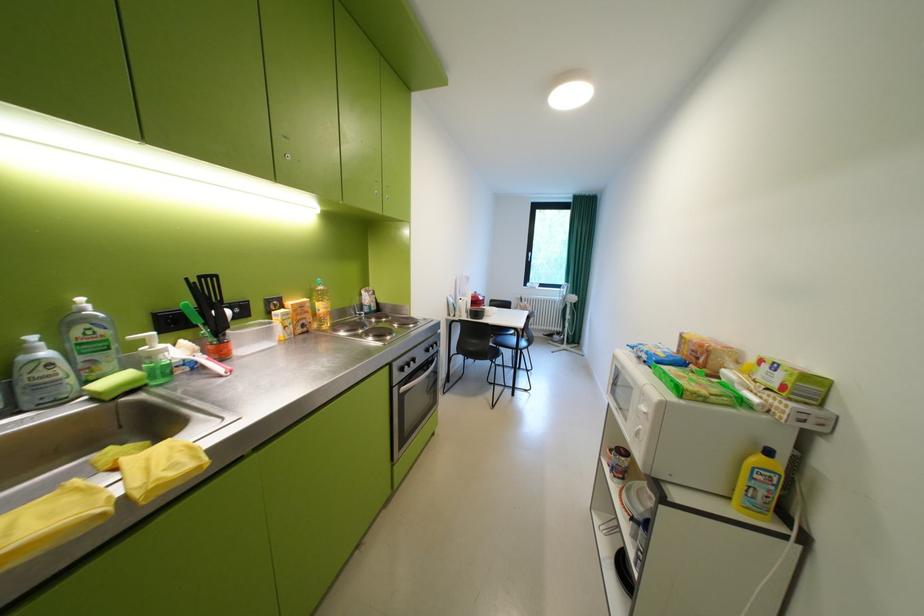
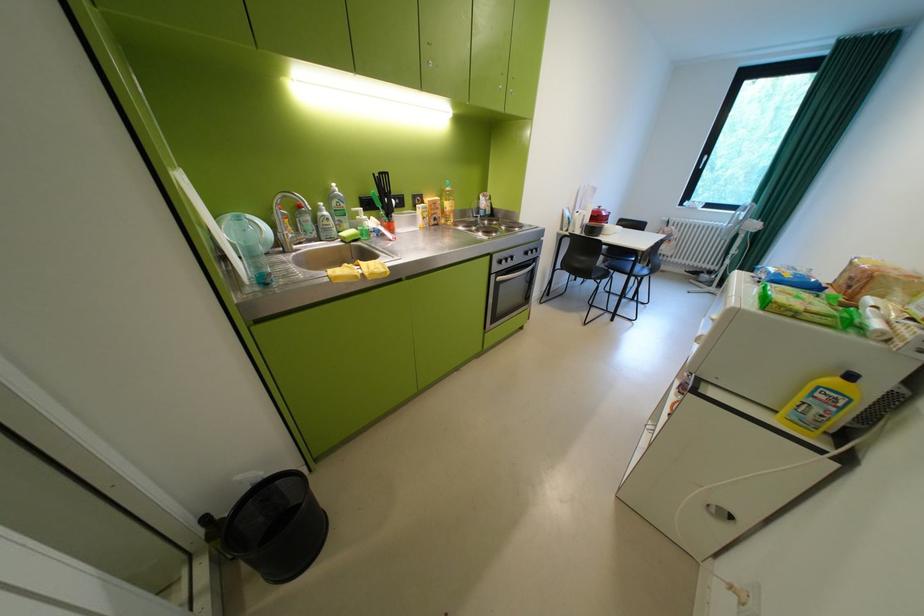
Find the pixel in the second image that matches point 407,367 in the first image.

(505, 257)